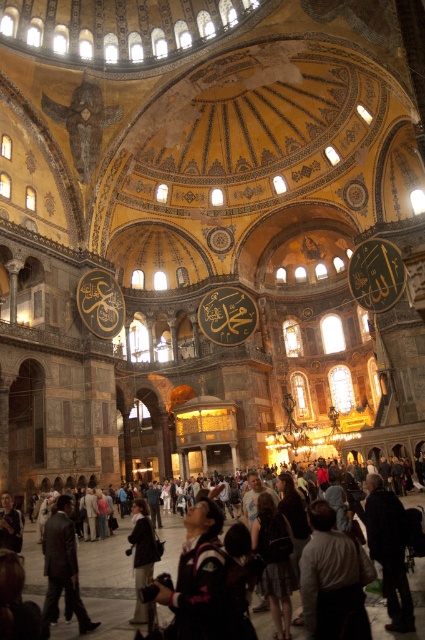
You are a GUI agent. You are given a task and a screenshot of the screen. Output one action in this format:
    pyautogui.click(x=<x>, y=<y>)
    Task: Click on the white cotton shirt at center
    The height and width of the screenshot is (640, 425).
    Given the screenshot: What is the action you would take?
    pyautogui.click(x=333, y=579)

Which is below, white cotton shirt at center or dark fabric coat at lower right?

dark fabric coat at lower right is below.

Is point (354, 586) behind point (394, 576)?

No, (354, 586) is in front of (394, 576).

Identify the location of white cotton shirt at center. (333, 579).

Can you confirm if white cotton shirt at center is positioned below dark gray fabric jacket at lower center?

Actually, white cotton shirt at center is above dark gray fabric jacket at lower center.

You are a GUI agent. You are given a task and a screenshot of the screen. Output one action in this format:
    pyautogui.click(x=<x>, y=<y>)
    Task: Click on the white cotton shirt at center
    
    Given the screenshot: What is the action you would take?
    pyautogui.click(x=333, y=579)

Is point (28, 547) positioned in front of point (133, 538)?

No, it is not.

Who is more distant from viewer, (224, 528) or (135, 618)?

The point (224, 528) is behind.

Does point (28, 540) come behind point (144, 556)?

Yes, point (28, 540) is farther from viewer.

Image resolution: width=425 pixels, height=640 pixels. I want to click on dark clothing crowd at lower center, so click(104, 588).